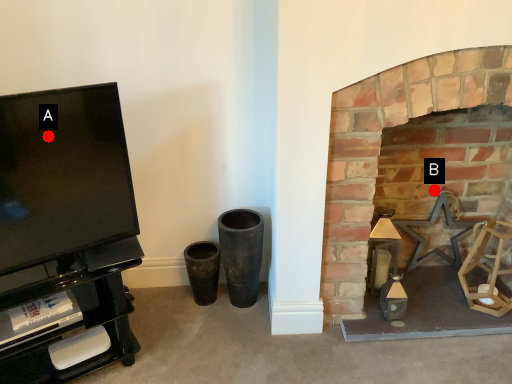
Question: Two points are circled on the image, labeled by A and B beside each circle. Which point is further to the camera?

Choices:
 (A) A is further
 (B) B is further

Answer: (B)